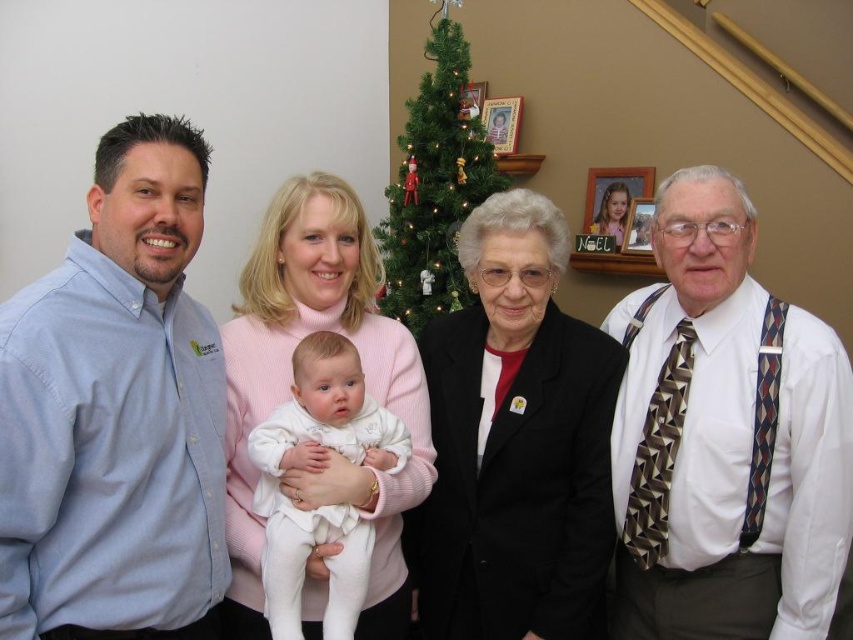
Question: Where is white textured shirt at right located in relation to white soft fabric baby at center in the image?

Choices:
 (A) above
 (B) below

Answer: (A)

Question: Based on their relative distances, which object is farther from the matte pink sweater at center?

Choices:
 (A) light blue button-down shirt at left
 (B) green artificial christmas tree at center

Answer: (B)

Question: Among these points, which one is nearest to the camera?

Choices:
 (A) (114, 243)
 (B) (418, 221)
 (C) (247, 582)
 (D) (271, 554)

Answer: (A)

Question: Estimate the real-world distances between objects in this image. Which object is farther from the white soft fabric baby at center?

Choices:
 (A) matte pink sweater at center
 (B) black fabric jacket at center
 (C) green artificial christmas tree at center

Answer: (C)

Question: Does white textured shirt at right have a larger size compared to matte pink sweater at center?

Choices:
 (A) no
 (B) yes

Answer: (B)

Question: Can you confirm if black fabric jacket at center is thinner than green artificial christmas tree at center?

Choices:
 (A) no
 (B) yes

Answer: (B)